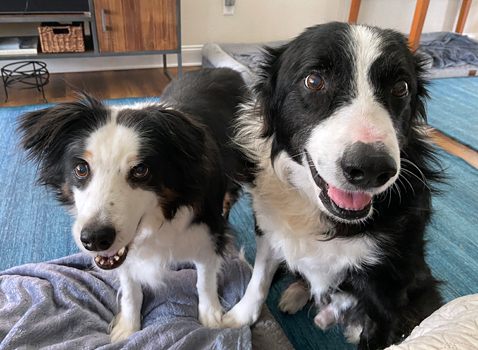
You are a GUI agent. You are given a task and a screenshot of the screen. Output one action in this format:
    pyautogui.click(x=<x>, y=<y>)
    Task: Click on the book
    Image resolution: width=478 pixels, height=350 pixels.
    Given the screenshot: What is the action you would take?
    click(x=30, y=48)